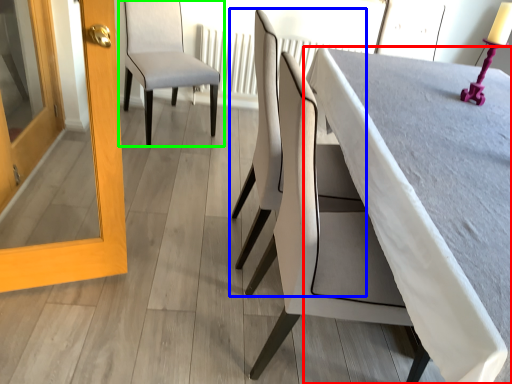
Question: Which is nearer to the table (highlighted by a red box)? chair (highlighted by a blue box) or chair (highlighted by a green box).

Choices:
 (A) chair
 (B) chair

Answer: (A)